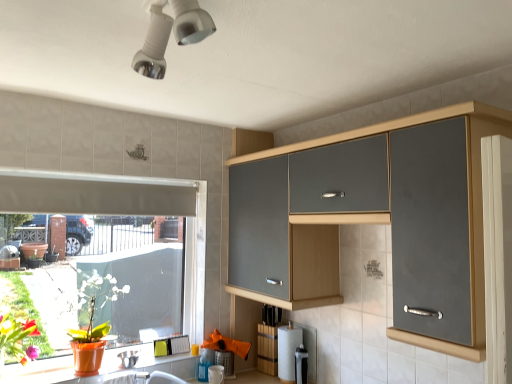
What do you see at coordinates (288, 351) in the screenshot? This screenshot has width=512, height=384. I see `white matte toilet paper at center` at bounding box center [288, 351].

Identify the location of satin silver bowl at lower left, which is counted as the 2th appliance, starting from the right. (129, 358).

Locate an element on the screen. This screenshot has height=384, width=512. matte orange pot at lower left is located at coordinates (24, 310).

What is the approximate height of white glossy counter at lower left?

It is 1.47 inches.

Find the location of `white glossy counter at lower left`. white glossy counter at lower left is located at coordinates (153, 363).

You are a GUI agent. You are given a task and a screenshot of the screen. Output one action in this format:
    pyautogui.click(x=<x>, y=<y>)
    Task: Click on the white matte toilet paper at center
    
    Given the screenshot: What is the action you would take?
    pyautogui.click(x=288, y=351)

In the scene shown: Is the position of white matte window at lower left less distant than that of white matte exhaust hood at left?

No, white matte window at lower left is further to the viewer.

Is white matte window at lower left looking in the opposite direction of white matte exhaust hood at left?

Yes, white matte window at lower left's orientation is away from white matte exhaust hood at left.

From the image's perspective, is white matte window at lower left under white matte exhaust hood at left?

Yes, from the image's perspective, white matte window at lower left is beneath white matte exhaust hood at left.

Does white matte exhaust hood at left have a lesser width compared to white matte toilet paper at center?

Yes.

Between white matte exhaust hood at left and white matte toilet paper at center, which one appears on the right side from the viewer's perspective?

white matte toilet paper at center.

Considering the positions of objects white matte exhaust hood at left and white matte toilet paper at center in the image provided, who is in front, white matte exhaust hood at left or white matte toilet paper at center?

white matte exhaust hood at left is in front.

Is white matte exhaust hood at left aimed at white matte toilet paper at center?

No, white matte exhaust hood at left is not oriented towards white matte toilet paper at center.

Can you confirm if white matte exhaust hood at left is positioned to the left of white matte window at lower left?

No.

Locate an element on the screen. This screenshot has height=384, width=512. exhaust hood that is on the right side of white matte window at lower left is located at coordinates (94, 194).

Does white matte exhaust hood at left have a smaller size compared to white matte window at lower left?

Correct, white matte exhaust hood at left occupies less space than white matte window at lower left.

Would you say white matte window at lower left is part of white matte exhaust hood at left's contents?

No, white matte window at lower left is not surrounded by white matte exhaust hood at left.

From the image's perspective, is satin silver bowl at lower left, the first appliance viewed from the left, beneath white matte window at lower left?

Yes, from the image's perspective, satin silver bowl at lower left, the first appliance viewed from the left, is beneath white matte window at lower left.

Measure the distance from satin silver bowl at lower left, which is counted as the 2th appliance, starting from the right, to white matte window at lower left.

satin silver bowl at lower left, which is counted as the 2th appliance, starting from the right, and white matte window at lower left are 29.62 inches apart.

From a real-world perspective, is satin silver bowl at lower left, the first appliance viewed from the left, physically located above or below white matte window at lower left?

Clearly, from a real-world perspective, satin silver bowl at lower left, the first appliance viewed from the left, is below white matte window at lower left.

In the scene shown: Considering the relative positions of satin silver bowl at lower left, the first appliance viewed from the left, and white matte window at lower left in the image provided, is satin silver bowl at lower left, the first appliance viewed from the left, to the right of white matte window at lower left from the viewer's perspective?

Yes, satin silver bowl at lower left, the first appliance viewed from the left, is to the right of white matte window at lower left.

Is white glossy counter at lower left facing towards matte orange pot at lower left?

No, white glossy counter at lower left is not turned towards matte orange pot at lower left.

From a real-world perspective, which is physically above, white glossy counter at lower left or matte orange pot at lower left?

From a 3D spatial view, matte orange pot at lower left is above.

Is the position of white glossy counter at lower left more distant than that of matte orange pot at lower left?

Yes, it is.

Which of these two, white glossy counter at lower left or matte orange pot at lower left, stands shorter?

Standing shorter between the two is white glossy counter at lower left.

From a real-world perspective, who is located lower, satin silver bowl at lower left, which is counted as the 2th appliance, starting from the right, or white glossy counter at lower left?

Result: In real-world perspective, white glossy counter at lower left is lower.

Is satin silver bowl at lower left, the first appliance viewed from the left, positioned far away from white glossy counter at lower left?

No, there isn't a large distance between satin silver bowl at lower left, the first appliance viewed from the left, and white glossy counter at lower left.

Which is behind, point (137, 354) or point (146, 362)?

The point (137, 354) is behind.

Can you confirm if satin silver bowl at lower left, the first appliance viewed from the left, is thinner than white glossy counter at lower left?

Correct, the width of satin silver bowl at lower left, the first appliance viewed from the left, is less than that of white glossy counter at lower left.

Considering the sizes of objects white matte window at lower left and matte gray cabinet at upper right in the image provided, who is bigger, white matte window at lower left or matte gray cabinet at upper right?

matte gray cabinet at upper right.

From the image's perspective, would you say white matte window at lower left is shown under matte gray cabinet at upper right?

Indeed, from the image's perspective, white matte window at lower left is shown beneath matte gray cabinet at upper right.

Is white matte window at lower left facing towards matte gray cabinet at upper right?

Yes, white matte window at lower left is oriented towards matte gray cabinet at upper right.

Consider the image. Considering the relative positions of white matte window at lower left and matte gray cabinet at upper right in the image provided, is white matte window at lower left to the left or to the right of matte gray cabinet at upper right?

Clearly, white matte window at lower left is on the left of matte gray cabinet at upper right in the image.

At what (x,y) coordinates should I click in order to perform the action: click on exhaust hood above the white matte window at lower left (from a real-world perspective). Please return your answer as a coordinate pair (x, y). Image resolution: width=512 pixels, height=384 pixels. Looking at the image, I should click on (94, 194).

I want to click on toilet paper behind the white matte exhaust hood at left, so click(288, 351).

Estimate the real-world distances between objects in this image. Which object is further from white matte window at lower left, matte gray cabinet at upper right or satin black coffee maker at lower center, the first appliance positioned from the right?

satin black coffee maker at lower center, the first appliance positioned from the right, is further to white matte window at lower left.

From the image, which object appears to be farther from white matte window at lower left, white glossy counter at lower left or white matte exhaust hood at left?

white glossy counter at lower left is further to white matte window at lower left.

When comparing their distances from white matte exhaust hood at left, does matte orange pot at lower left or white matte toilet paper at center seem closer?

The object closer to white matte exhaust hood at left is matte orange pot at lower left.

Looking at this image, from the image, which object appears to be farther from matte orange pot at lower left, satin silver bowl at lower left, which is counted as the 2th appliance, starting from the right, or white matte exhaust hood at left?

white matte exhaust hood at left lies further to matte orange pot at lower left than the other object.

Considering their positions, is white matte toilet paper at center positioned closer to satin black coffee maker at lower center, the first appliance positioned from the right, than white matte window at lower left?

white matte toilet paper at center is closer to satin black coffee maker at lower center, the first appliance positioned from the right.

From the image, which object appears to be nearer to white matte window at lower left, white glossy counter at lower left or satin black coffee maker at lower center, the first appliance positioned from the right?

Based on the image, white glossy counter at lower left appears to be nearer to white matte window at lower left.

Estimate the real-world distances between objects in this image. Which object is closer to white matte exhaust hood at left, satin silver bowl at lower left, which is counted as the 2th appliance, starting from the right, or matte gray cabinet at upper right?

satin silver bowl at lower left, which is counted as the 2th appliance, starting from the right, lies closer to white matte exhaust hood at left than the other object.

Considering their positions, is white glossy counter at lower left positioned further to white matte toilet paper at center than matte orange pot at lower left?

The object further to white matte toilet paper at center is matte orange pot at lower left.

Where is `window situated between matte orange pot at lower left and white matte toilet paper at center from left to right`? The image size is (512, 384). window situated between matte orange pot at lower left and white matte toilet paper at center from left to right is located at coordinates (125, 212).

Where is `plant between white matte window at lower left and white glossy counter at lower left vertically`? The image size is (512, 384). plant between white matte window at lower left and white glossy counter at lower left vertically is located at coordinates (24, 310).

This screenshot has width=512, height=384. I want to click on exhaust hood located between white matte window at lower left and matte gray cabinet at upper right in the left-right direction, so click(94, 194).

This screenshot has height=384, width=512. Identify the location of plant between white matte window at lower left and satin silver bowl at lower left, which is counted as the 2th appliance, starting from the right, in the vertical direction. [x=24, y=310].